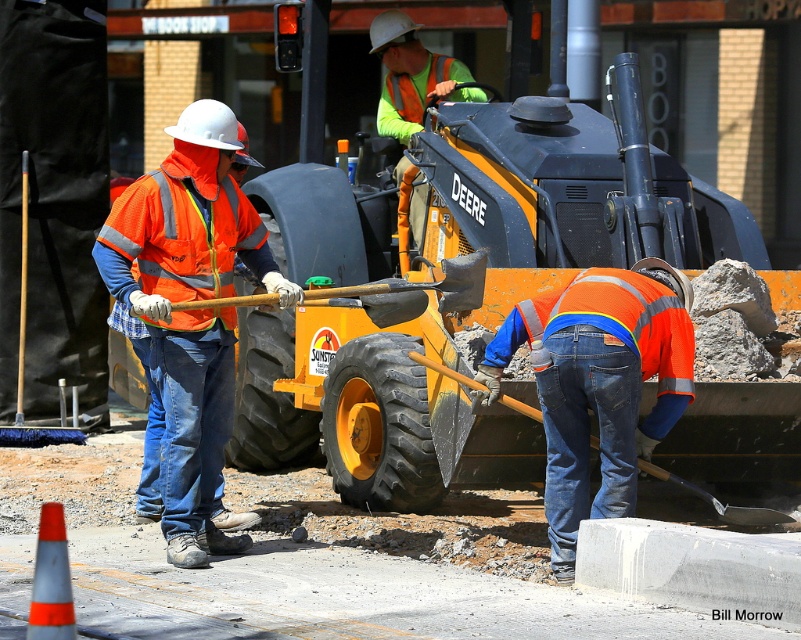
Question: Observing the image, what is the correct spatial positioning of orange reflective vest at left in reference to matte black shovel at lower center?

Choices:
 (A) right
 (B) left

Answer: (B)

Question: Which of the following is the farthest from the observer?

Choices:
 (A) wooden handle shovel at center
 (B) orange reflective vest at left

Answer: (A)

Question: Which object is the farthest from the wooden handle shovel at center?

Choices:
 (A) orange reflective vest at left
 (B) yellow rubber tire at center
 (C) matte black shovel at lower center

Answer: (B)

Question: Is orange reflective vest at left below matte black shovel at lower center?

Choices:
 (A) no
 (B) yes

Answer: (A)

Question: Estimate the real-world distances between objects in this image. Which object is closer to the orange reflective vest at left?

Choices:
 (A) matte black shovel at lower center
 (B) wooden handle shovel at center
 (C) gray concrete block at lower right

Answer: (B)

Question: Is yellow rubber tire at center positioned behind wooden handle shovel at center?

Choices:
 (A) yes
 (B) no

Answer: (A)